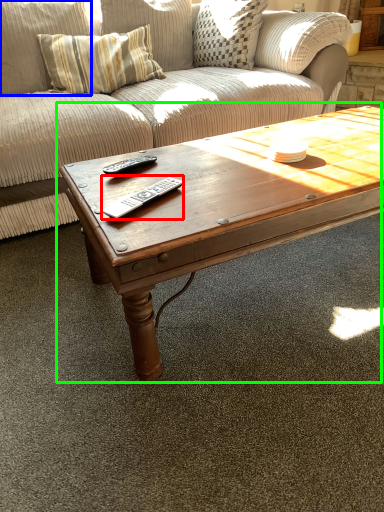
Question: Which is nearer to the remote (highlighted by a red box)? pillow (highlighted by a blue box) or coffee table (highlighted by a green box).

Choices:
 (A) pillow
 (B) coffee table

Answer: (B)